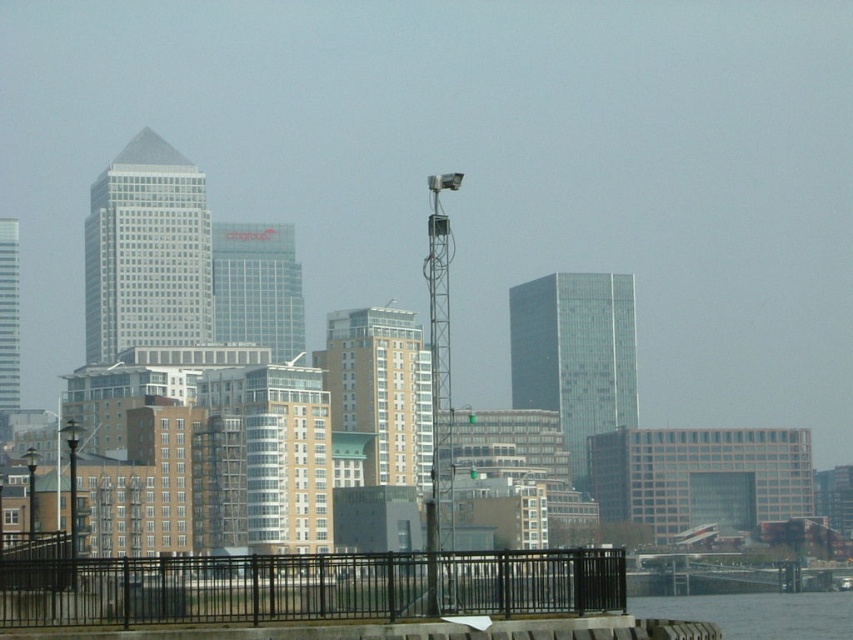
You are standing at the point marked as point (346, 428) in the cityscape image. The construction crane is located 1200 feet away from you. Can you determine if the construction crane is closer to you than the point?

The distance of point (346, 428) from camera is 1086.84 feet. Since the construction crane is 1200 feet away from you, it is farther than the point, so the point is closer to you than the construction crane.